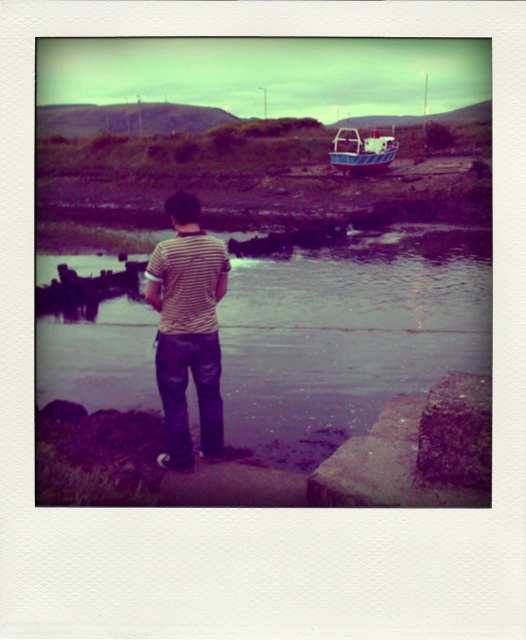
Question: Is purple water at center thinner than blue painted wooden boat at upper right?

Choices:
 (A) no
 (B) yes

Answer: (A)

Question: Does purple water at center have a smaller size compared to striped cotton shirt at center?

Choices:
 (A) no
 (B) yes

Answer: (A)

Question: Can you confirm if purple water at center is positioned to the right of blue painted wooden boat at upper right?

Choices:
 (A) no
 (B) yes

Answer: (A)

Question: Which point is closer to the camera?

Choices:
 (A) blue painted wooden boat at upper right
 (B) purple water at center

Answer: (B)

Question: Which point is farther to the camera?

Choices:
 (A) (107, 378)
 (B) (190, 294)

Answer: (A)

Question: Among these points, which one is nearest to the camera?

Choices:
 (A) (457, 246)
 (B) (357, 150)

Answer: (A)